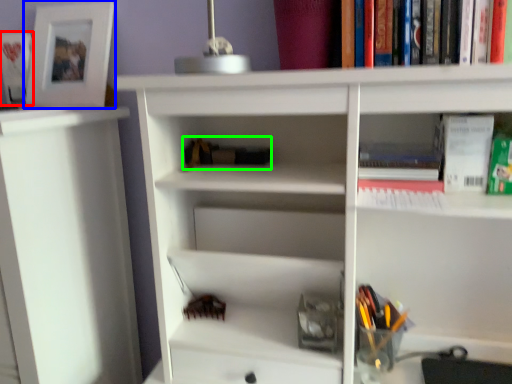
Question: Which object is positioned farthest from book (highlighted by a red box)? Select from picture frame (highlighted by a blue box) and book (highlighted by a green box).

Choices:
 (A) picture frame
 (B) book

Answer: (B)